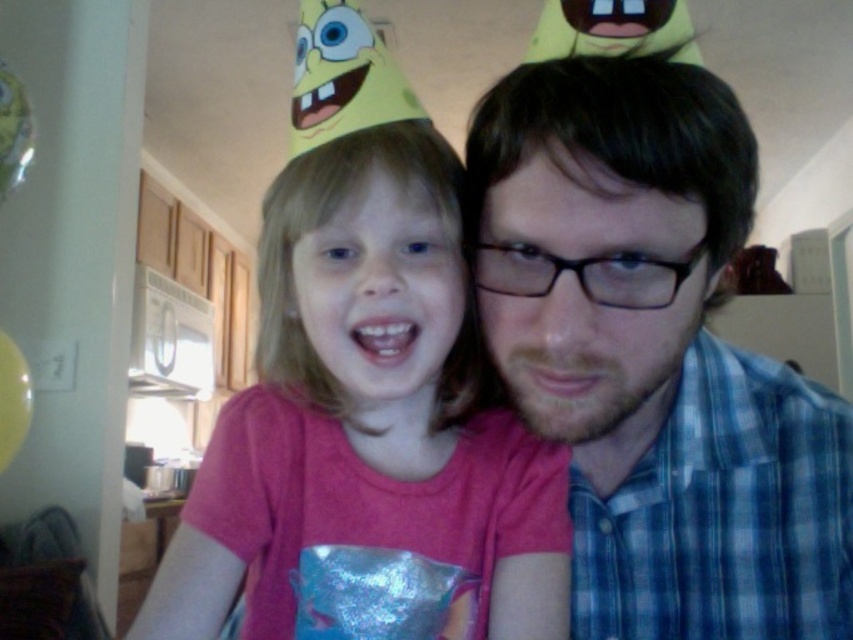
Locate an element on the screen. blue plaid shirt at center is located at coordinates (656, 356).

Is blue plaid shirt at center bigger than pink matte shirt at center?

Yes, blue plaid shirt at center is bigger than pink matte shirt at center.

Where is `blue plaid shirt at center`? blue plaid shirt at center is located at coordinates (656, 356).